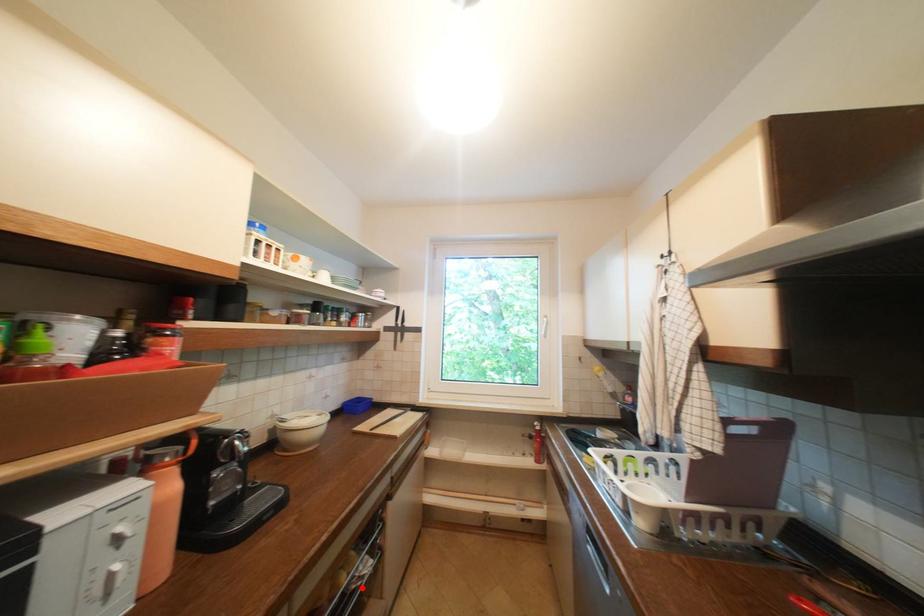
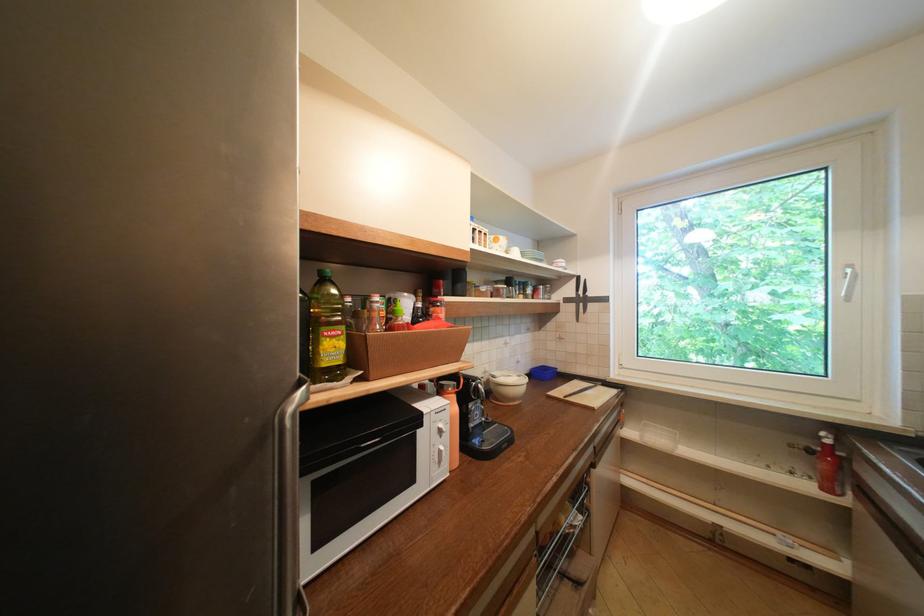
Question: I am providing you with two images of the same scene from different viewpoints. A red point is shown in image1. For the corresponding object point in image2, is it positioned nearer or farther from the camera?

Choices:
 (A) Nearer
 (B) Farther

Answer: (B)